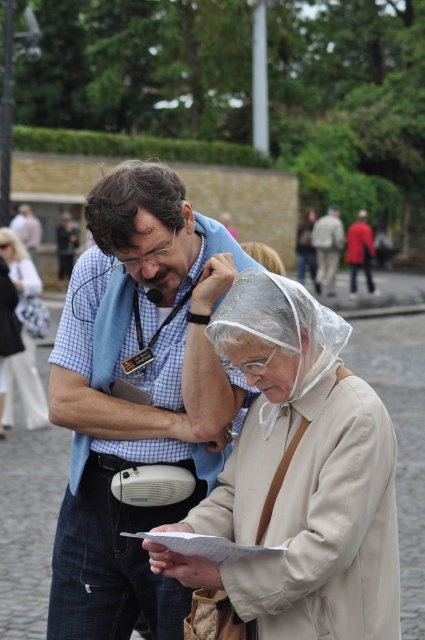
Question: In this image, where is blue checkered shirt at center located relative to light beige jacket at center?

Choices:
 (A) above
 (B) below

Answer: (B)

Question: Among these objects, which one is nearest to the camera?

Choices:
 (A) matte white purse at left
 (B) transparent plastic rain hat at upper center

Answer: (B)

Question: Which point appears closest to the camera in this image?

Choices:
 (A) (27, 333)
 (B) (243, 244)
 (C) (328, 410)

Answer: (C)

Question: Does beige fabric coat at center lie behind red fabric jacket at center?

Choices:
 (A) yes
 (B) no

Answer: (B)

Question: Which object is the closest to the blue checkered shirt at center?

Choices:
 (A) transparent plastic rain hat at upper center
 (B) light beige jacket at center

Answer: (A)

Question: Does matte white purse at left come behind red fabric jacket at center?

Choices:
 (A) no
 (B) yes

Answer: (A)